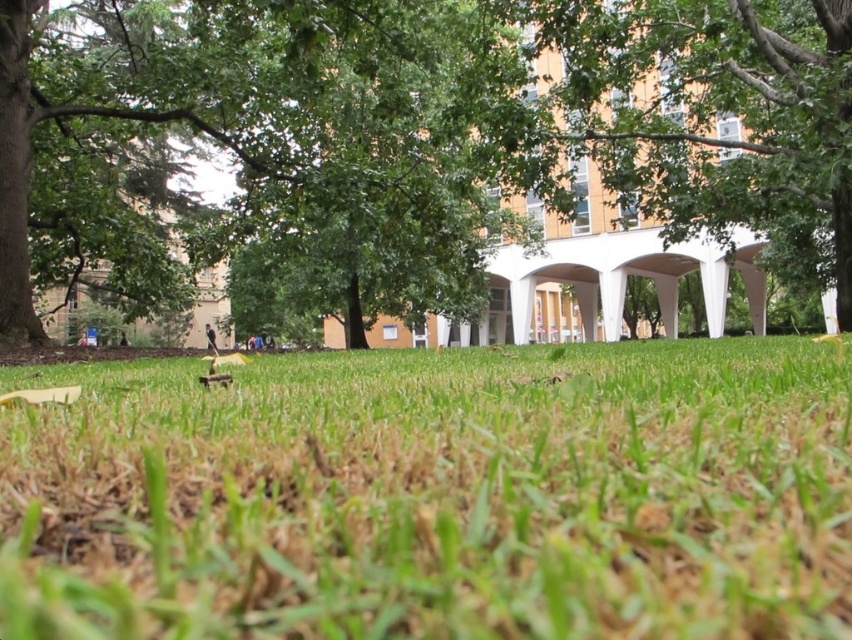
From the picture: You are a gardener planning to mow the lawn. You notice the green grass at center and the green leafy tree at center in the scene. Which area requires mowing, and why?

The green grass at center requires mowing because its width is less than that of the green leafy tree at center, indicating it might be shorter and in need of trimming.

You are standing at the point closest to the camera in the scene. Which of the two points, point (769, 390) or point (691, 93), is closer to you?

Point (769, 390) is in front of point (691, 93), so it is closer to you.

In the scene shown: You are standing at the edge of the grassy area and want to place a small garden ornament exactly where the green grass at center is located. According to the coordinates provided, where should you place it?

The green grass at center is located at point (x=435, y=493), so you should place the ornament at those coordinates to match its position.